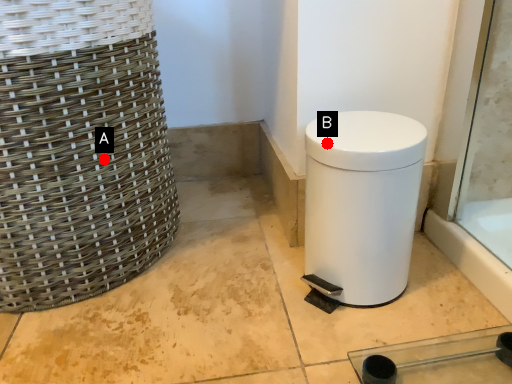
Question: Two points are circled on the image, labeled by A and B beside each circle. Which point is closer to the camera?

Choices:
 (A) A is closer
 (B) B is closer

Answer: (B)